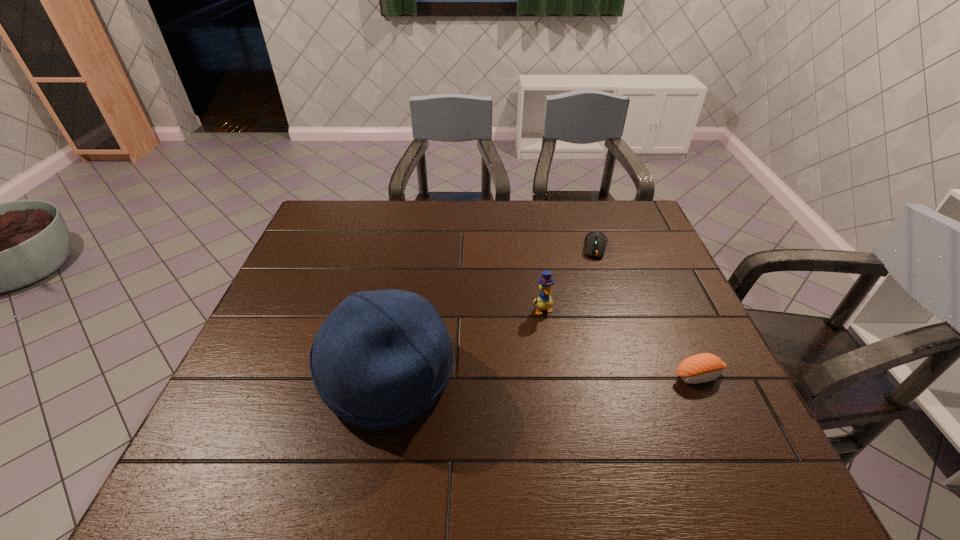
Where is `unoccupied position between the duckling and the sushi`? unoccupied position between the duckling and the sushi is located at coordinates (621, 343).

Where is `free space between the farthest object and the tallest object`? free space between the farthest object and the tallest object is located at coordinates (492, 312).

At what (x,y) coordinates should I click in order to perform the action: click on vacant point located between the third object from right to left and the third tallest object. Please return your answer as a coordinate pair (x, y). Image resolution: width=960 pixels, height=540 pixels. Looking at the image, I should click on (621, 343).

Where is `free space between the computer equipment and the sushi`? free space between the computer equipment and the sushi is located at coordinates (647, 312).

Find the location of a particular element. This screenshot has width=960, height=540. vacant area between the leftmost object and the farthest object is located at coordinates (x=492, y=312).

The height and width of the screenshot is (540, 960). Find the location of `free space between the duckling and the leftmost object`. free space between the duckling and the leftmost object is located at coordinates (466, 343).

This screenshot has width=960, height=540. What are the coordinates of `object identified as the second closest to the third object from right to left` in the screenshot? It's located at pyautogui.click(x=595, y=242).

Identify the location of object that can be found as the closest to the rightmost object. (544, 301).

At what (x,y) coordinates should I click in order to perform the action: click on free location that satisfies the following two spatial constraints: 1. on the back side of the farthest object; 2. on the right side of the leftmost object. Please return your answer as a coordinate pair (x, y). Image resolution: width=960 pixels, height=540 pixels. Looking at the image, I should click on (412, 247).